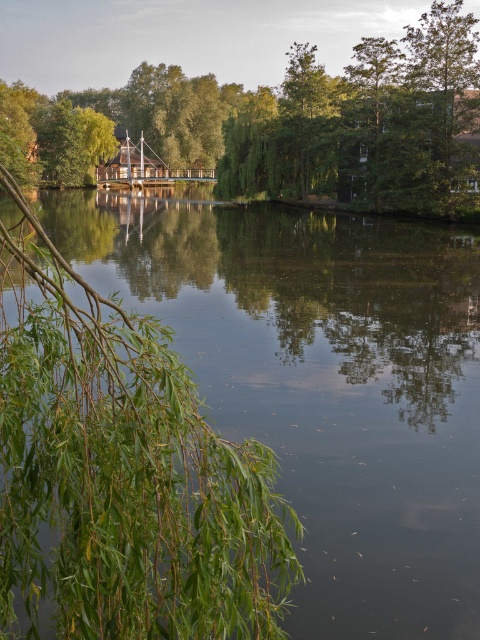
Which is more to the left, green leafy branches at lower left or green leafy tree at center?

From the viewer's perspective, green leafy branches at lower left appears more on the left side.

Which is below, green leafy branches at lower left or green leafy tree at center?

Positioned lower is green leafy branches at lower left.

Is point (405, 564) less distant than point (354, 182)?

Yes, it is.

This screenshot has height=640, width=480. I want to click on green leafy branches at lower left, so click(x=225, y=456).